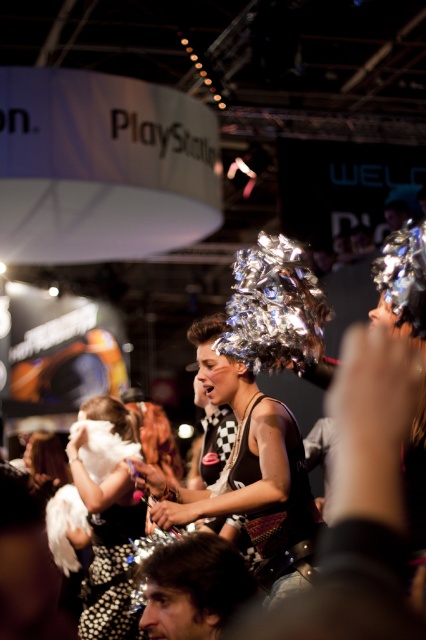
You are standing in the middle of the event hall and see two points marked in the image. Which point is closer to you, point (218,371) or point (198,593)?

Point (198,593) is closer to you because it is less further to the camera than point (218,371).

You are at the event and want to take a photo of the dark brown hair at lower left without including the white fluffy wings at center in the frame. Which direction should you move your camera to achieve this?

Move your camera to the right to exclude the white fluffy wings at center, as they are currently positioned to the left of the dark brown hair at lower left.